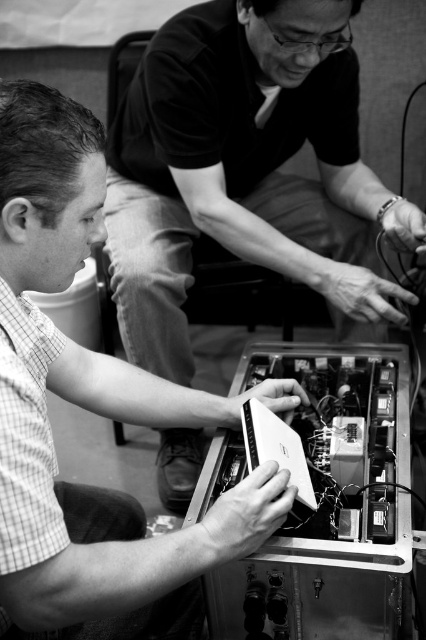
You are a technician trying to determine which device to prioritize based on size. Given the metallic circuit board at center and the matte white laptop at lower center, which one requires more workspace due to its size?

The metallic circuit board at center requires more workspace because it is larger in size than the matte white laptop at lower center.

You are a technician who needs to reach the metallic circuit board at center to perform a repair. You have a tool that can extend up to 4 feet. Will your tool be long enough to reach the circuit board without moving closer?

The metallic circuit board at center is 4.09 feet from viewer. Since the tool can only extend up to 4 feet, it is 0.09 feet too short to reach the circuit board without moving closer.

You are standing in the workshop and need to locate the metallic circuit board at center. According to the coordinates provided, where exactly is it positioned?

The metallic circuit board at center is located at point (x=245, y=170).